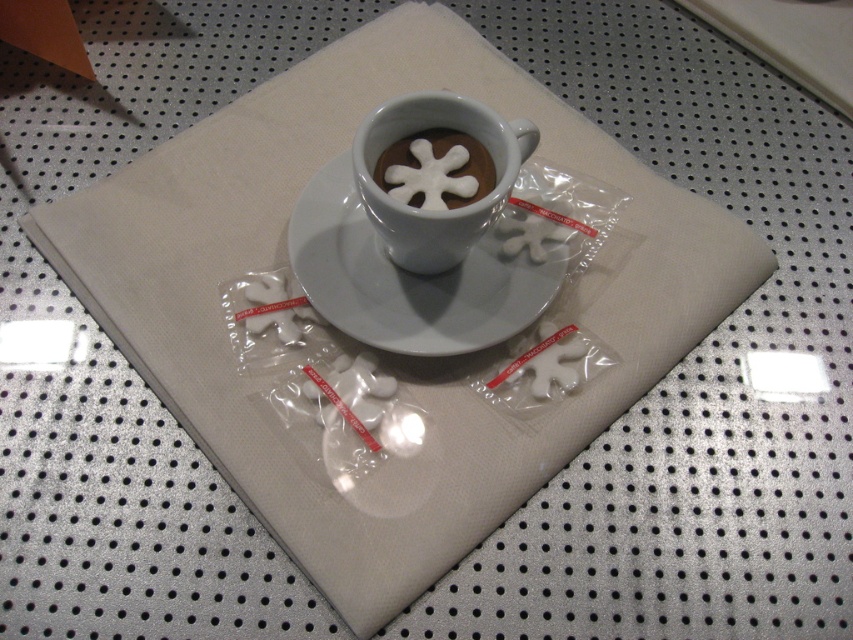
Between white glossy saucer at center and white frothy snowflake at center, which one appears on the right side from the viewer's perspective?

white frothy snowflake at center is more to the right.

From the picture: Which of these two, white glossy saucer at center or white frothy snowflake at center, stands taller?

Standing taller between the two is white glossy saucer at center.

Image resolution: width=853 pixels, height=640 pixels. What do you see at coordinates (409, 278) in the screenshot? I see `white glossy saucer at center` at bounding box center [409, 278].

Where is `white glossy saucer at center`? white glossy saucer at center is located at coordinates (409, 278).